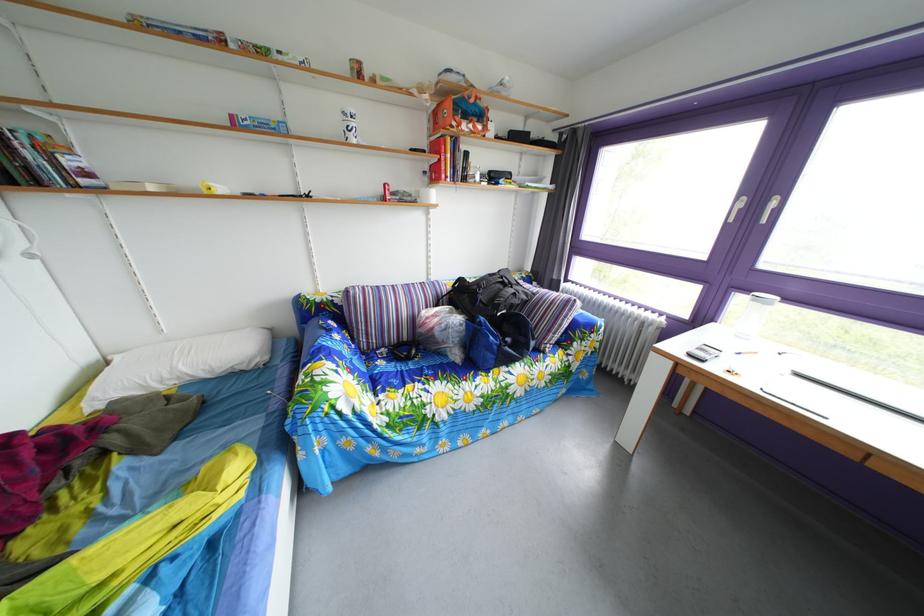
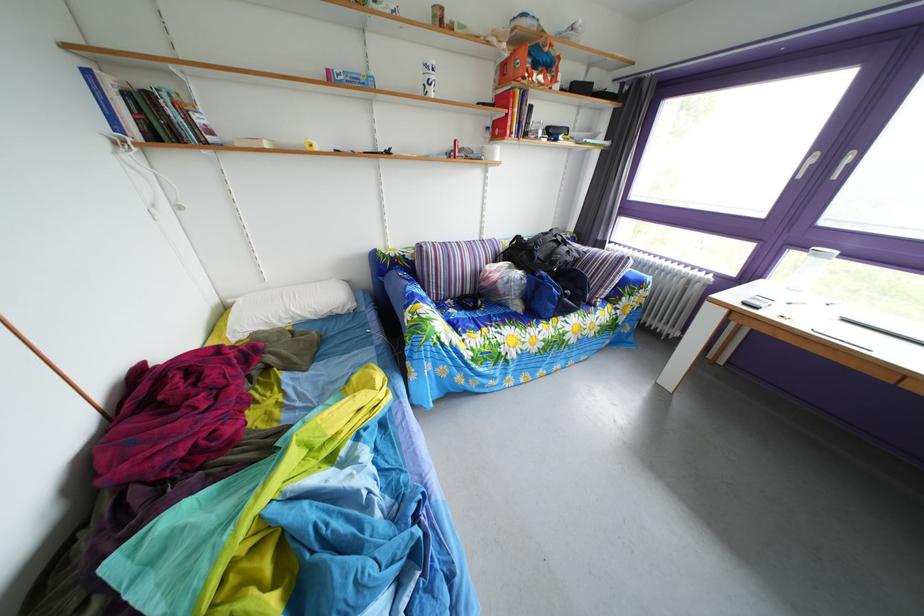
In the second image, find the point that corresponds to the point at 492,328 in the first image.

(553, 282)